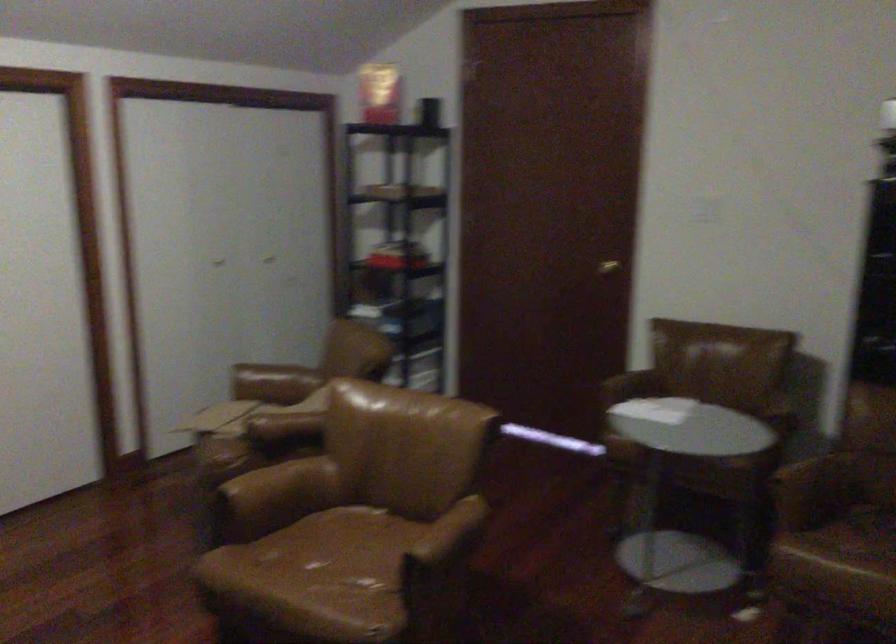
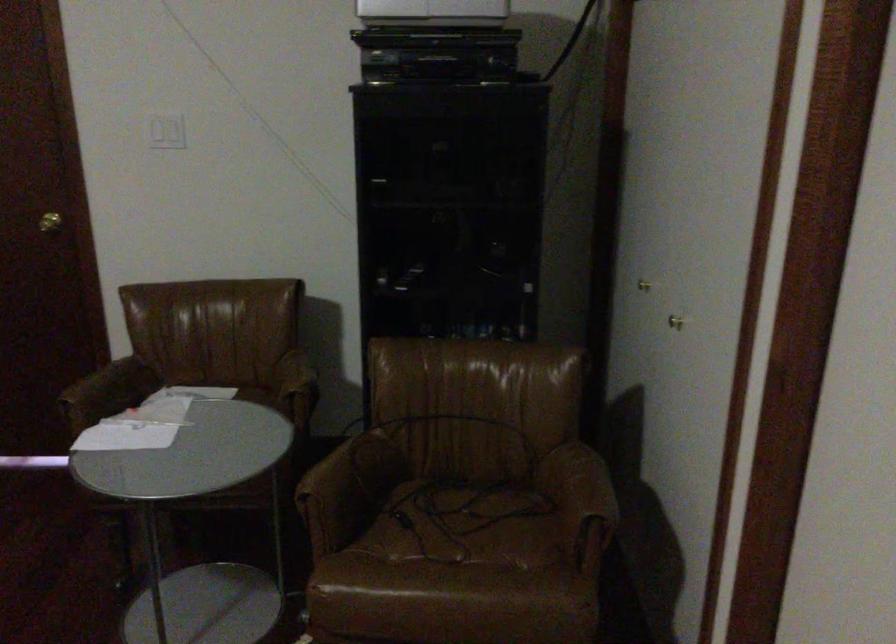
Question: Based on the continuous images, in which direction is the camera rotating? Reply with the corresponding letter.

Choices:
 (A) Left
 (B) Right
 (C) Up
 (D) Down

Answer: (B)